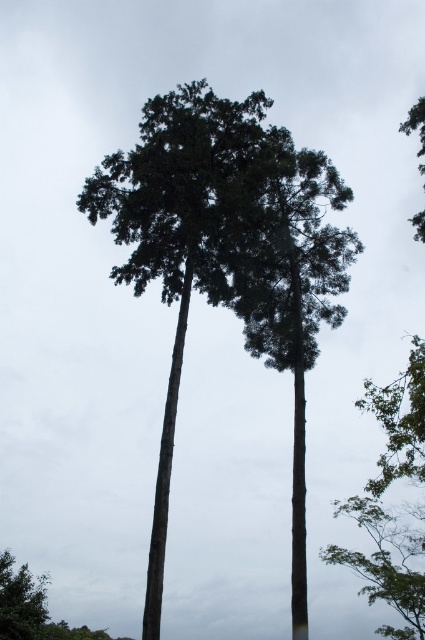
You are standing in a garden and see a point marked at coordinates (181, 234). Which object from the scene does this point belong to?

The point at coordinates (181, 234) is on the green leafy palm tree at center.

Based on the photo, you are standing at the base of the trees and looking upward. There are two points marked on the trees. Which point is closer to you, point (201, 163) or point (286, 232)?

Point (201, 163) is closer to the viewer than point (286, 232).